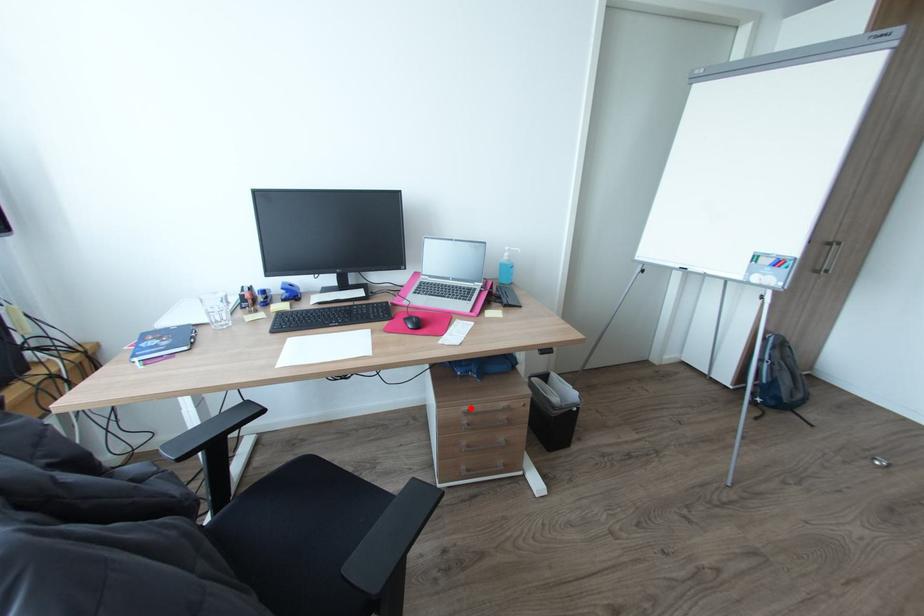
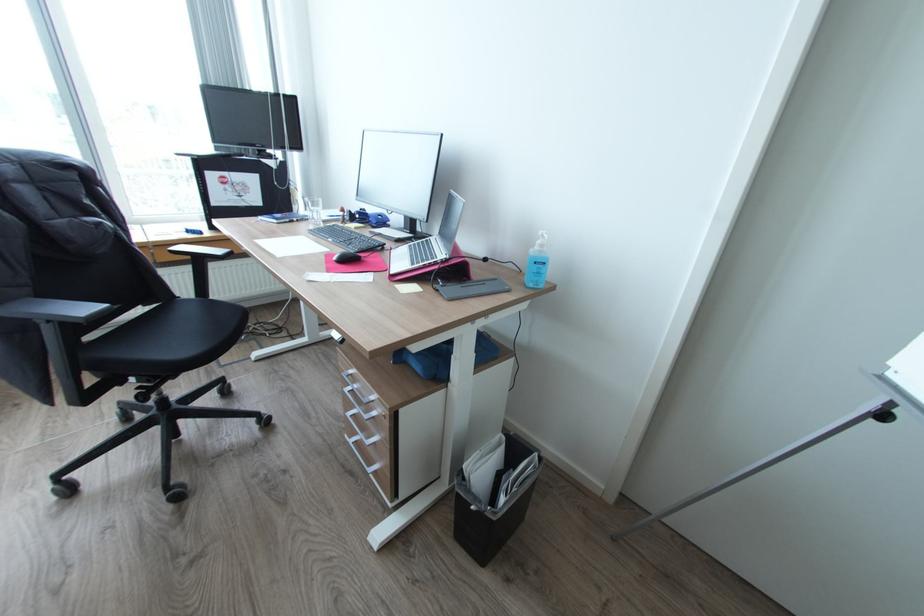
Find the pixel in the second image that matches the highlighted location in the first image.

(357, 371)